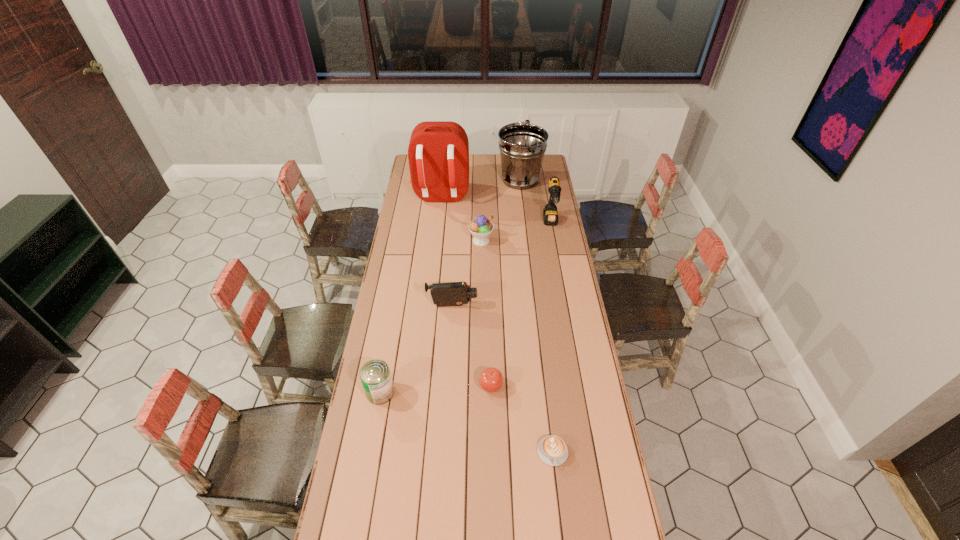
I want to click on empty location between the seventh tallest object and the can, so click(x=436, y=389).

The height and width of the screenshot is (540, 960). I want to click on empty space between the drill and the seventh tallest object, so click(521, 305).

Where is `unoccupied area between the apple and the bucket`? unoccupied area between the apple and the bucket is located at coordinates point(505,283).

Find the location of a particular element. The image size is (960, 540). vacant space in between the fifth farthest object and the can is located at coordinates (417, 349).

At what (x,y) coordinates should I click in order to perform the action: click on vacant area between the second tallest object and the drill. Please return your answer as a coordinate pair (x, y). This screenshot has height=540, width=960. Looking at the image, I should click on click(536, 201).

Locate an element on the screen. The height and width of the screenshot is (540, 960). blank region between the second shortest object and the seventh shortest object is located at coordinates (505, 283).

Identify the location of object that is the second closest to the fourth nearest object. (481, 227).

The image size is (960, 540). Find the location of `object that is the closest to the fifth farthest object`. object that is the closest to the fifth farthest object is located at coordinates (491, 379).

Locate an element on the screen. The height and width of the screenshot is (540, 960). vacant space that satisfies the following two spatial constraints: 1. on the front-facing side of the fifth farthest object; 2. on the back side of the apple is located at coordinates (447, 386).

Where is `free location that satisfies the following two spatial constraints: 1. on the strap side of the backpack; 2. on the right side of the seventh tallest object`? free location that satisfies the following two spatial constraints: 1. on the strap side of the backpack; 2. on the right side of the seventh tallest object is located at coordinates (420, 386).